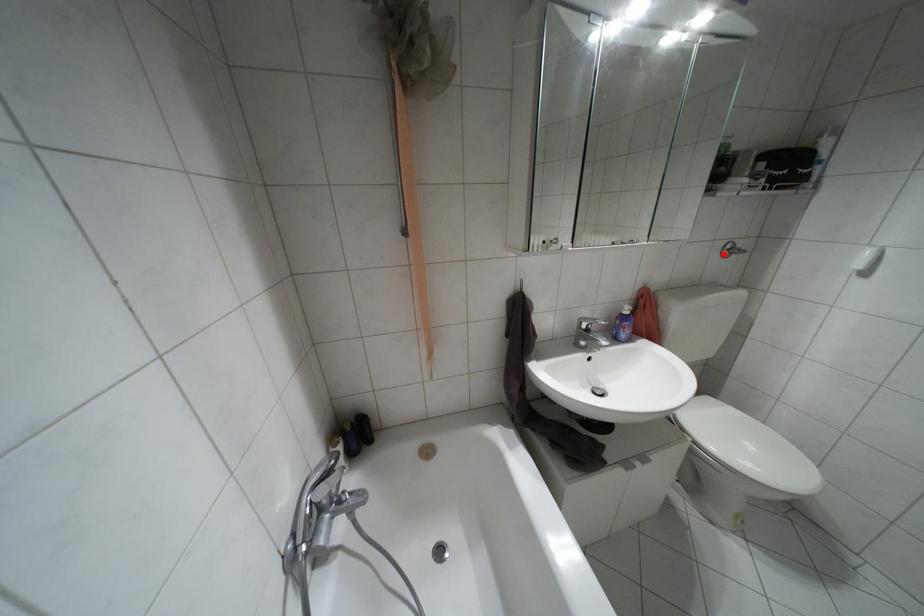
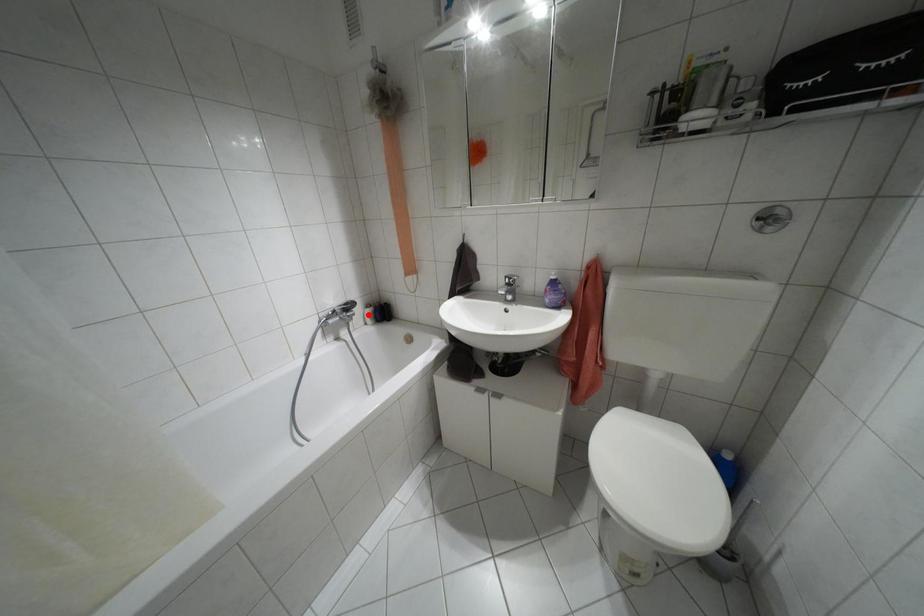
I am providing you with two images of the same scene from different viewpoints. A red point is marked on the first image and another point is marked on the second image. Do the highlighted points in image1 and image2 indicate the same real-world spot?

No